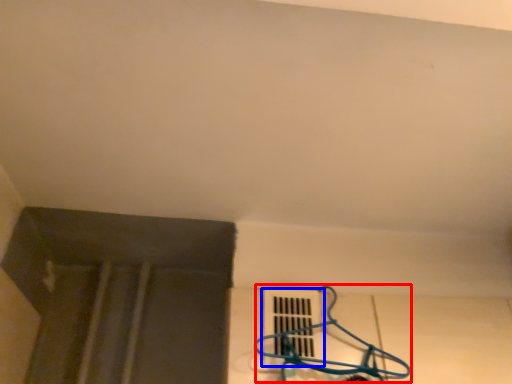
Question: Among these objects, which one is farthest to the camera, hanger (highlighted by a red box) or window (highlighted by a blue box)?

Choices:
 (A) hanger
 (B) window

Answer: (B)